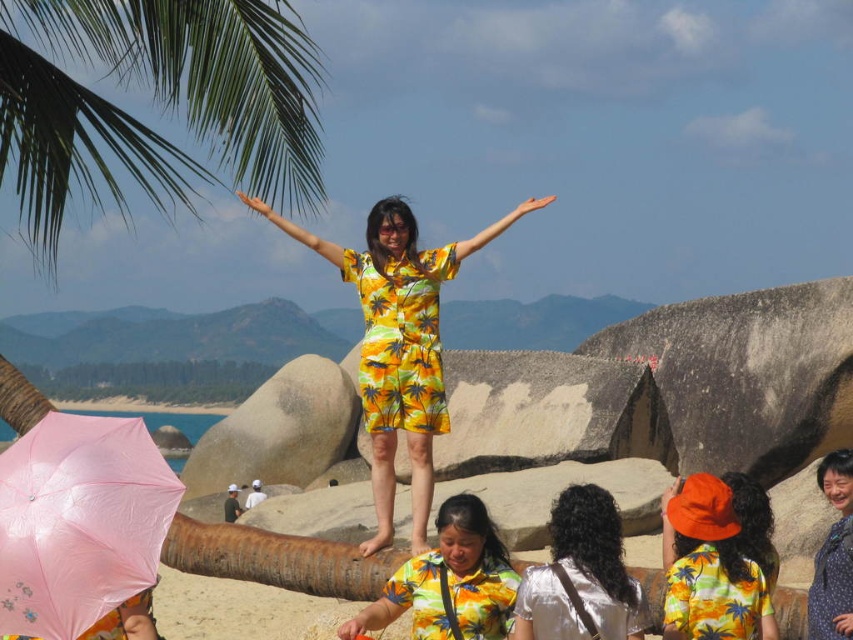
Can you confirm if green leafy palm tree at upper left is positioned to the right of yellow palm print fabric dress at center?

No, green leafy palm tree at upper left is not to the right of yellow palm print fabric dress at center.

Who is more distant from viewer, (68, 150) or (410, 410)?

The point (68, 150) is more distant.

You are a GUI agent. You are given a task and a screenshot of the screen. Output one action in this format:
    pyautogui.click(x=<x>, y=<y>)
    Task: Click on the green leafy palm tree at upper left
    
    Given the screenshot: What is the action you would take?
    pyautogui.click(x=155, y=100)

Between yellow printed shirt at center and matte floral dress at center, which one appears on the right side from the viewer's perspective?

From the viewer's perspective, matte floral dress at center appears more on the right side.

Who is lower down, yellow printed shirt at center or matte floral dress at center?

Positioned lower is yellow printed shirt at center.

Does point (457, 550) come behind point (834, 609)?

Yes.

I want to click on yellow printed shirt at center, so click(450, 580).

Which is in front, point (410, 273) or point (703, 509)?

Point (703, 509)

Can you confirm if yellow printed dress at center is positioned below orange cotton hat at center?

Actually, yellow printed dress at center is above orange cotton hat at center.

Where is `yellow printed dress at center`? yellow printed dress at center is located at coordinates (398, 342).